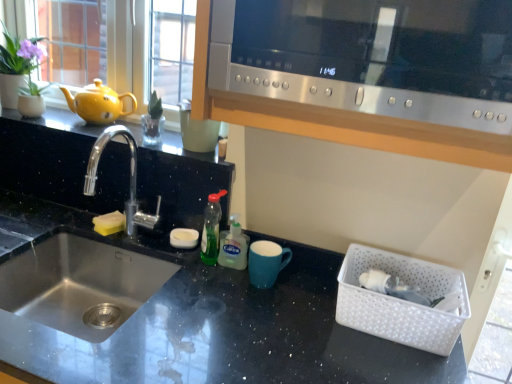
At what (x,y) coordinates should I click in order to perform the action: click on vacant area in front of white plastic basket at lower right. Please return your answer as a coordinate pair (x, y). Image resolution: width=512 pixels, height=384 pixels. Looking at the image, I should click on (383, 359).